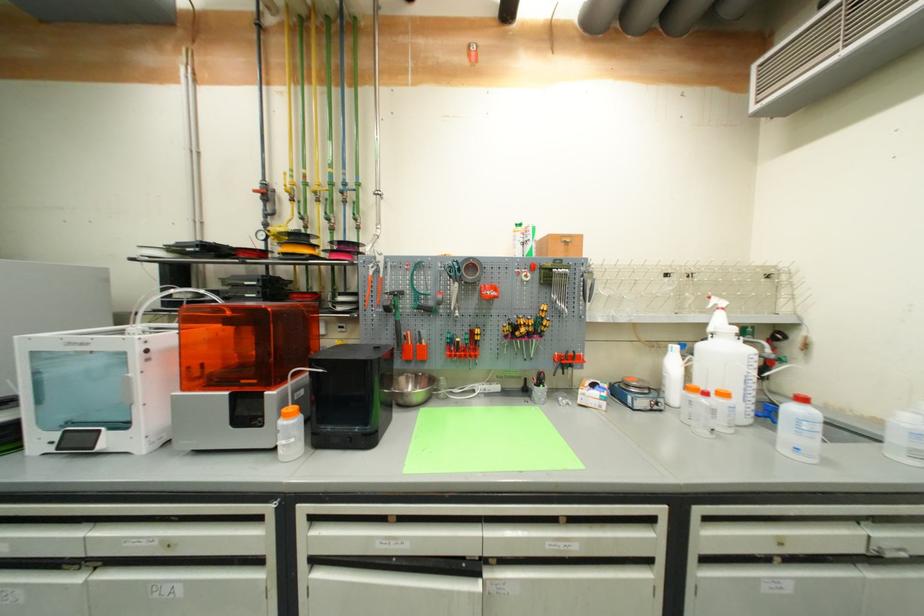
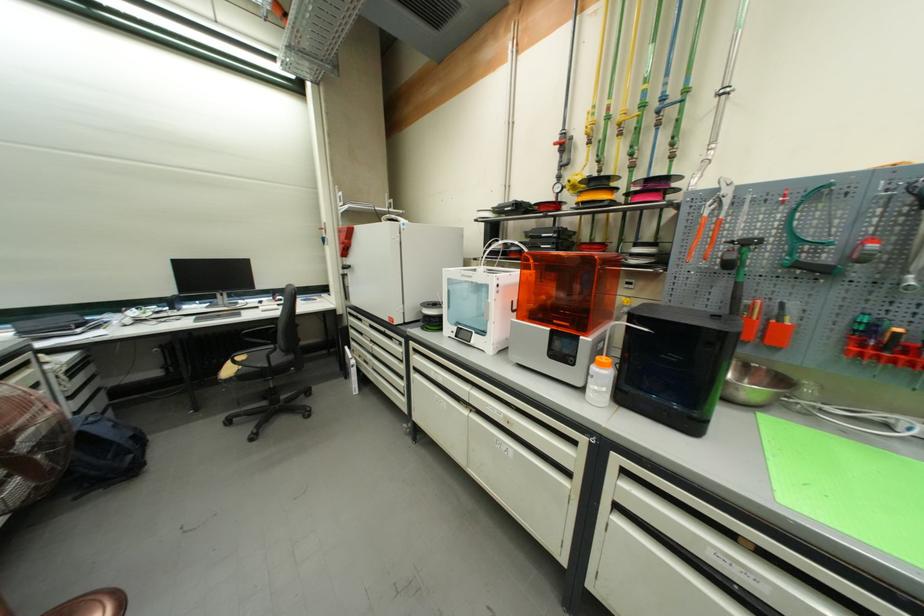
Where in the second image is the point corresponding to [380,270] from the first image?

(719, 208)